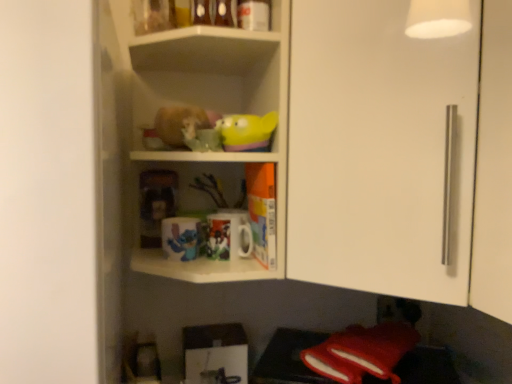
Question: Considering the relative positions of white glossy cabinet door at upper right and rubber duck at upper center, acting as the first toy starting from the right, in the image provided, is white glossy cabinet door at upper right in front of rubber duck at upper center, acting as the first toy starting from the right,?

Choices:
 (A) yes
 (B) no

Answer: (A)

Question: Is white glossy cabinet door at upper right facing towards rubber duck at upper center, which ranks as the 1th toy in front-to-back order?

Choices:
 (A) no
 (B) yes

Answer: (A)

Question: From the image's perspective, is white glossy cabinet door at upper right on rubber duck at upper center, acting as the first toy starting from the right?

Choices:
 (A) no
 (B) yes

Answer: (B)

Question: Is white glossy cabinet door at upper right further to camera compared to rubber duck at upper center, acting as the first toy starting from the right?

Choices:
 (A) no
 (B) yes

Answer: (A)

Question: Is white glossy cabinet door at upper right outside of rubber duck at upper center, the 2th toy from the back?

Choices:
 (A) no
 (B) yes

Answer: (B)

Question: Would you say white glossy shelves at upper center is to the left or to the right of matte plastic toy at center, the 1th toy ordered from the bottom, in the picture?

Choices:
 (A) left
 (B) right

Answer: (B)

Question: From the image's perspective, relative to matte plastic toy at center, the 1th toy ordered from the bottom, is white glossy shelves at upper center above or below?

Choices:
 (A) above
 (B) below

Answer: (A)

Question: Is white glossy shelves at upper center wider or thinner than matte plastic toy at center, the 1th toy ordered from the bottom?

Choices:
 (A) wide
 (B) thin

Answer: (A)

Question: Considering their positions, is white glossy shelves at upper center located in front of or behind matte plastic toy at center, the 1th toy when ordered from back to front?

Choices:
 (A) behind
 (B) front

Answer: (B)

Question: Considering the positions of rubber duck at upper center, acting as the first toy starting from the right, and matte plastic toy at center, which ranks as the second toy in right-to-left order, in the image, is rubber duck at upper center, acting as the first toy starting from the right, taller or shorter than matte plastic toy at center, which ranks as the second toy in right-to-left order,?

Choices:
 (A) tall
 (B) short

Answer: (B)

Question: From a real-world perspective, is rubber duck at upper center, which is the 2th toy from bottom to top, physically located above or below matte plastic toy at center, which ranks as the second toy in right-to-left order?

Choices:
 (A) above
 (B) below

Answer: (A)

Question: Based on their positions, is rubber duck at upper center, the 2th toy from the back, located to the left or right of matte plastic toy at center, which ranks as the second toy in right-to-left order?

Choices:
 (A) right
 (B) left

Answer: (A)

Question: From the image's perspective, is rubber duck at upper center, which is the 2th toy from bottom to top, located above or below matte plastic toy at center, the 1th toy ordered from the bottom?

Choices:
 (A) below
 (B) above

Answer: (B)

Question: From a real-world perspective, is matte ceramic mug at center, acting as the 2th mug starting from the left, physically located above or below fuzzy fabric hamster at center?

Choices:
 (A) above
 (B) below

Answer: (B)

Question: From the image's perspective, is matte ceramic mug at center, acting as the 2th mug starting from the left, above or below fuzzy fabric hamster at center?

Choices:
 (A) below
 (B) above

Answer: (A)